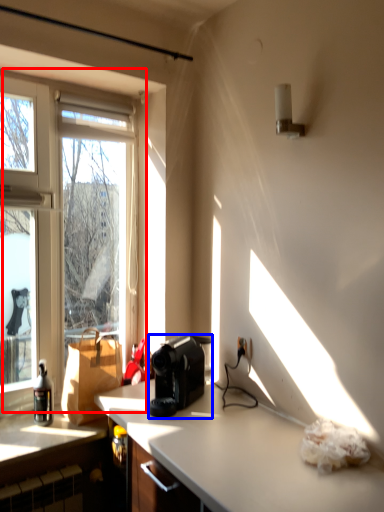
Question: Among these objects, which one is nearest to the camera, window (highlighted by a red box) or coffee maker (highlighted by a blue box)?

Choices:
 (A) window
 (B) coffee maker

Answer: (B)